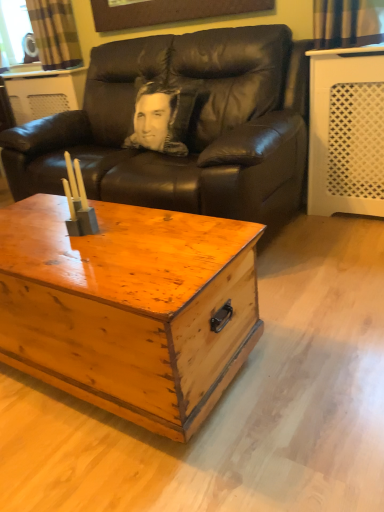
Question: Is plaid fabric curtain at upper left wider than black leather couch at center?

Choices:
 (A) yes
 (B) no

Answer: (B)

Question: From the image's perspective, does plaid fabric curtain at upper left appear higher than black leather couch at center?

Choices:
 (A) no
 (B) yes

Answer: (B)

Question: Is plaid fabric curtain at upper left shorter than black leather couch at center?

Choices:
 (A) no
 (B) yes

Answer: (B)

Question: Is plaid fabric curtain at upper left positioned far away from black leather couch at center?

Choices:
 (A) yes
 (B) no

Answer: (B)

Question: Considering the relative sizes of plaid fabric curtain at upper left and black leather couch at center in the image provided, is plaid fabric curtain at upper left smaller than black leather couch at center?

Choices:
 (A) no
 (B) yes

Answer: (B)

Question: Is black leather couch at center inside or outside of wooden chest at center?

Choices:
 (A) outside
 (B) inside

Answer: (A)

Question: In the image, is black leather couch at center positioned in front of or behind wooden chest at center?

Choices:
 (A) front
 (B) behind

Answer: (B)

Question: Based on their sizes in the image, would you say black leather couch at center is bigger or smaller than wooden chest at center?

Choices:
 (A) small
 (B) big

Answer: (B)

Question: Is black leather couch at center wider or thinner than wooden chest at center?

Choices:
 (A) thin
 (B) wide

Answer: (B)

Question: From the image's perspective, is wooden chest at center above or below black leather couch at center?

Choices:
 (A) below
 (B) above

Answer: (A)

Question: Does point (69, 373) appear closer or farther from the camera than point (274, 122)?

Choices:
 (A) closer
 (B) farther

Answer: (A)

Question: Based on their sizes in the image, would you say wooden chest at center is bigger or smaller than black leather couch at center?

Choices:
 (A) small
 (B) big

Answer: (A)

Question: Looking at their shapes, would you say wooden chest at center is wider or thinner than black leather couch at center?

Choices:
 (A) thin
 (B) wide

Answer: (A)

Question: From their relative heights in the image, would you say plaid fabric curtain at upper left is taller or shorter than wooden chest at center?

Choices:
 (A) tall
 (B) short

Answer: (B)

Question: Looking at the image, does plaid fabric curtain at upper left seem bigger or smaller compared to wooden chest at center?

Choices:
 (A) small
 (B) big

Answer: (A)